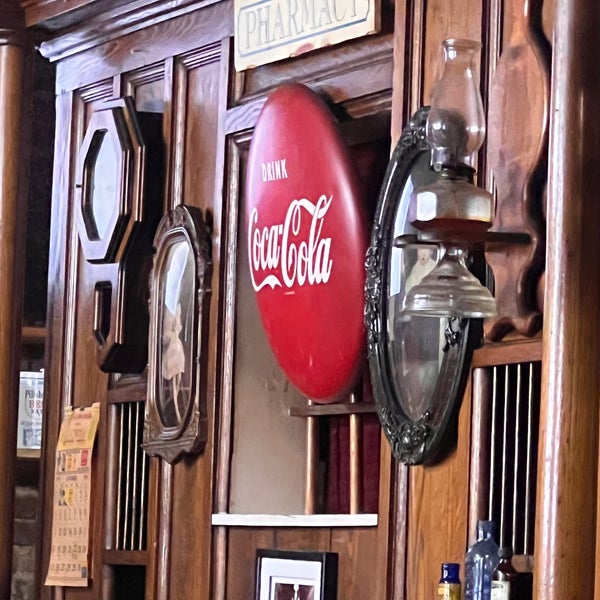
Image resolution: width=600 pixels, height=600 pixels. What are the coordinates of `brick wall` in the screenshot? It's located at (26, 535).